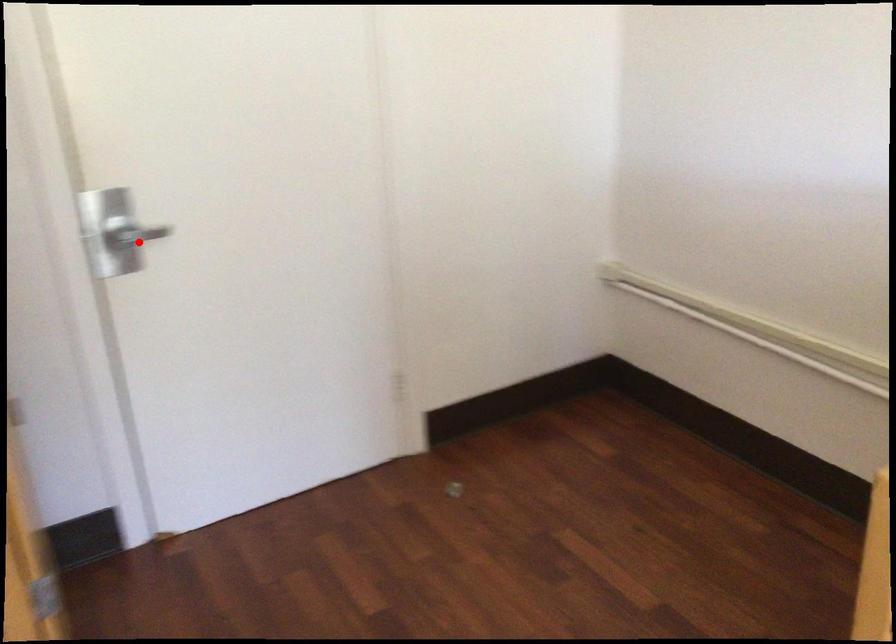
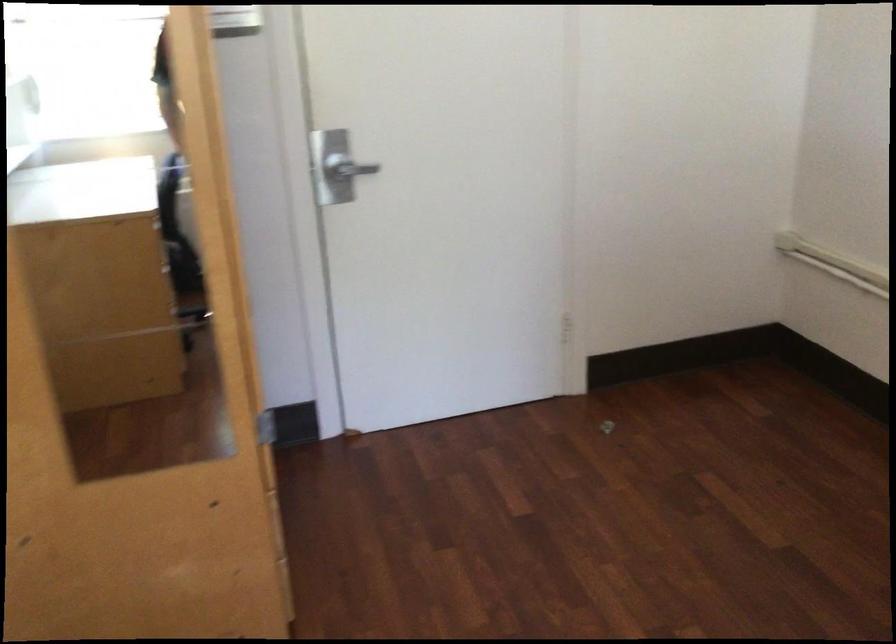
In the second image, find the point that corresponds to the highlighted location in the first image.

(350, 174)